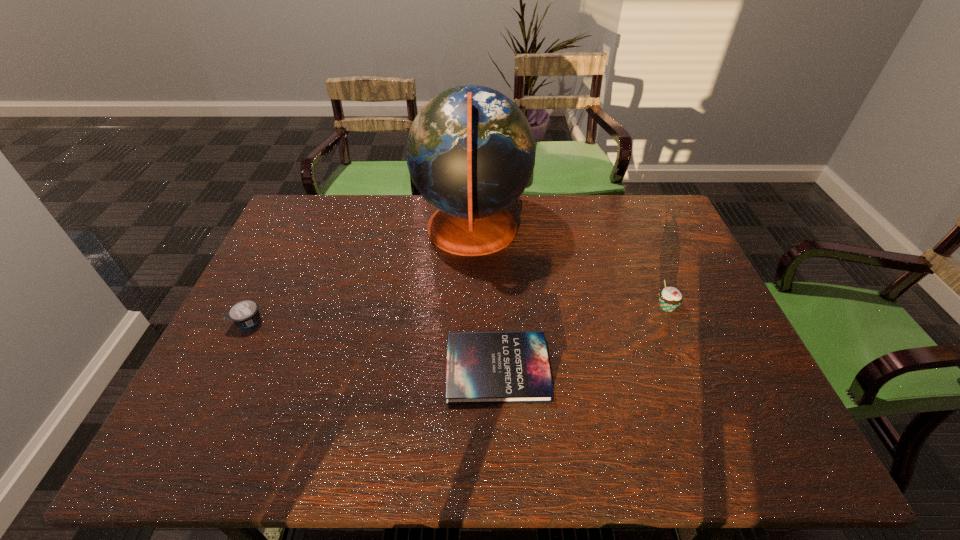
You are a GUI agent. You are given a task and a screenshot of the screen. Output one action in this format:
    pyautogui.click(x=<x>, y=<y>)
    Task: Click on the farthest object
    The width and height of the screenshot is (960, 540).
    Given the screenshot: What is the action you would take?
    pyautogui.click(x=470, y=151)

Locate an element on the screen. This screenshot has width=960, height=540. globe is located at coordinates (470, 151).

You are a GUI agent. You are given a task and a screenshot of the screen. Output one action in this format:
    pyautogui.click(x=<x>, y=<y>)
    Task: Click on the rightmost object
    The image size is (960, 540).
    Given the screenshot: What is the action you would take?
    pyautogui.click(x=670, y=298)

Image resolution: width=960 pixels, height=540 pixels. Find the location of `the second tallest object`. the second tallest object is located at coordinates (670, 298).

Find the location of a particular element. The image size is (960, 540). yogurt is located at coordinates (245, 313).

At what (x,y) coordinates should I click in order to perform the action: click on the second shortest object. Please return your answer as a coordinate pair (x, y). Looking at the image, I should click on (245, 313).

This screenshot has height=540, width=960. Find the location of `hardback book`. hardback book is located at coordinates (482, 367).

Where is `the shortest object`? the shortest object is located at coordinates (482, 367).

Identify the location of vacant region located with the Americas facing the viewer on the globe. (588, 230).

The width and height of the screenshot is (960, 540). I want to click on vacant space located 0.230m on the back of the second tallest object, so click(641, 246).